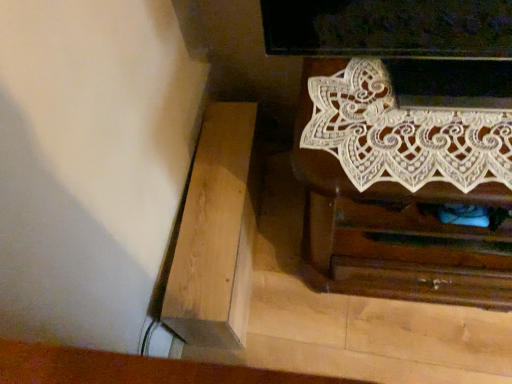
Question: From a real-world perspective, is light brown wood at lower left physically above white lace chest of drawers at upper right?

Choices:
 (A) yes
 (B) no

Answer: (B)

Question: Is light brown wood at lower left oriented towards white lace chest of drawers at upper right?

Choices:
 (A) yes
 (B) no

Answer: (A)

Question: Is light brown wood at lower left far from white lace chest of drawers at upper right?

Choices:
 (A) no
 (B) yes

Answer: (A)

Question: Is light brown wood at lower left turned away from white lace chest of drawers at upper right?

Choices:
 (A) no
 (B) yes

Answer: (A)

Question: Does light brown wood at lower left appear on the right side of white lace chest of drawers at upper right?

Choices:
 (A) no
 (B) yes

Answer: (A)

Question: Is light brown wood at lower left further to the viewer compared to white lace chest of drawers at upper right?

Choices:
 (A) no
 (B) yes

Answer: (B)

Question: Would you say white lace chest of drawers at upper right is outside light brown wood at lower left?

Choices:
 (A) yes
 (B) no

Answer: (A)

Question: Is white lace chest of drawers at upper right facing away from light brown wood at lower left?

Choices:
 (A) no
 (B) yes

Answer: (A)

Question: Is light brown wood at lower left completely or partially inside white lace chest of drawers at upper right?

Choices:
 (A) yes
 (B) no

Answer: (B)

Question: Does white lace chest of drawers at upper right appear on the right side of light brown wood at lower left?

Choices:
 (A) no
 (B) yes

Answer: (B)

Question: Is white lace chest of drawers at upper right closer to the viewer compared to light brown wood at lower left?

Choices:
 (A) yes
 (B) no

Answer: (A)

Question: From a real-world perspective, is white lace chest of drawers at upper right physically below light brown wood at lower left?

Choices:
 (A) no
 (B) yes

Answer: (A)

Question: Is white lace chest of drawers at upper right situated inside light brown wood at lower left or outside?

Choices:
 (A) outside
 (B) inside

Answer: (A)